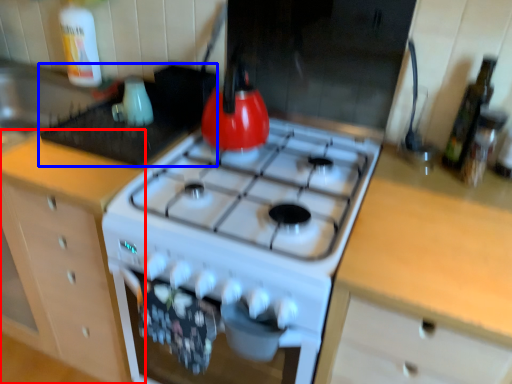
Question: Among these objects, which one is nearest to the camera, cabinetry (highlighted by a red box) or appliance (highlighted by a blue box)?

Choices:
 (A) cabinetry
 (B) appliance

Answer: (A)